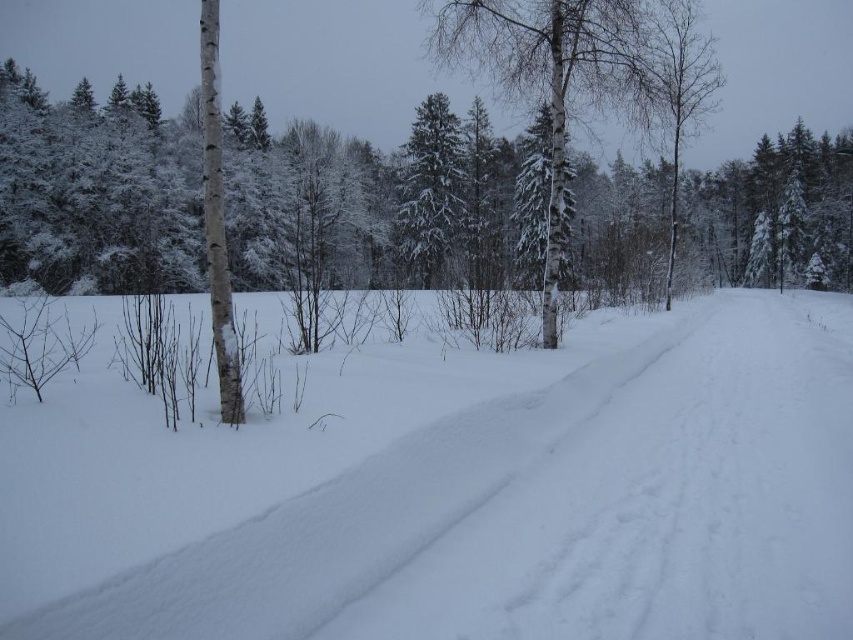
Who is shorter, snow-covered evergreen tree at center or white smooth tree at left?

white smooth tree at left is shorter.

Who is positioned more to the left, snow-covered evergreen tree at center or white smooth tree at left?

white smooth tree at left

Is point (462, 188) closer to viewer compared to point (219, 323)?

No, (462, 188) is behind (219, 323).

This screenshot has width=853, height=640. Identify the location of snow-covered evergreen tree at center. (430, 188).

Who is shorter, white fluffy snow at center or white smooth tree at left?

white fluffy snow at center

Which is above, white fluffy snow at center or white smooth tree at left?

white smooth tree at left

The image size is (853, 640). Find the location of `white fluffy snow at center`. white fluffy snow at center is located at coordinates (556, 509).

Who is positioned more to the right, white fluffy snow at center or snow-covered evergreen tree at center?

Positioned to the right is white fluffy snow at center.

Identify the location of white fluffy snow at center. (556, 509).